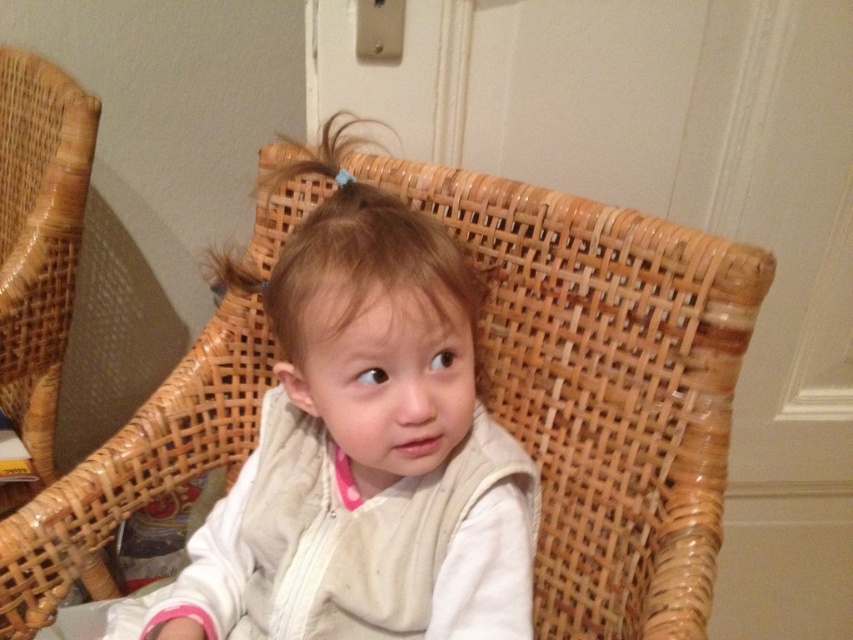
You are a parent trying to decide whether to place a new toy on the white cotton baby at center or the woven wood rocking chair at left. Which object is shorter and thus safer for the baby to reach?

The white cotton baby at center is shorter than the woven wood rocking chair at left, so placing the toy on the white cotton baby at center would be safer for the baby to reach.

You are standing in front of the wicker chair and notice two points marked on the wall behind it. The first point is at coordinates point (323,208) and the second point is at point (16,376). Which of these points is nearer to you?

Point (323,208) is closer to the viewer than point (16,376), so the first point is nearer to you.

You are a parent trying to place a new toy on the floor between the white cotton baby at center and the woven wood rocking chair at left. Based on their widths, which object requires more space horizontally?

The white cotton baby at center requires more horizontal space because its width surpasses that of the woven wood rocking chair at left.